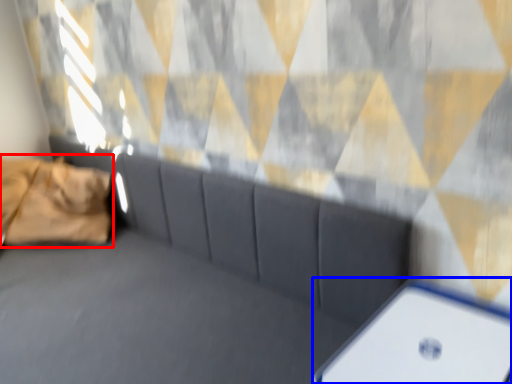
Question: Among these objects, which one is farthest to the camera, pillow (highlighted by a red box) or furniture (highlighted by a blue box)?

Choices:
 (A) pillow
 (B) furniture

Answer: (A)